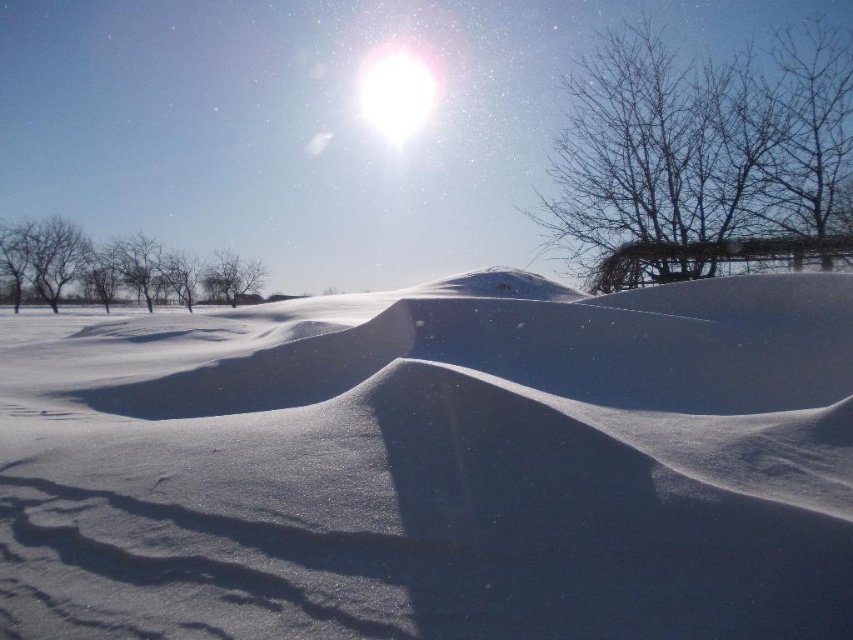
From the picture: You are an outdoor photographer planning to take a photo of the white fluffy snow at center and the bare branches at upper right. You want to ensure both elements are in focus. Given that your camera has a depth of field that can cover 10 meters, will both elements be in focus?

Result: The white fluffy snow at center is 12.64 meters from the bare branches at upper right. Since the distance between them exceeds the camera depth of field of 10 meters, both elements may not be in focus simultaneously.

You are an observer standing in the winter landscape. You see the white fluffy snow at center and the bare branches at left. Which object takes up more space in the image?

The bare branches at left take up more space in the image because the white fluffy snow at center is smaller than the bare branches at left.